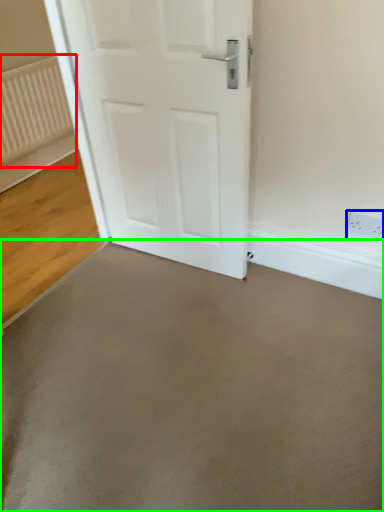
Question: Which is nearer to the radiator (highlighted by a red box)? electric outlet (highlighted by a blue box) or concrete (highlighted by a green box).

Choices:
 (A) electric outlet
 (B) concrete

Answer: (B)